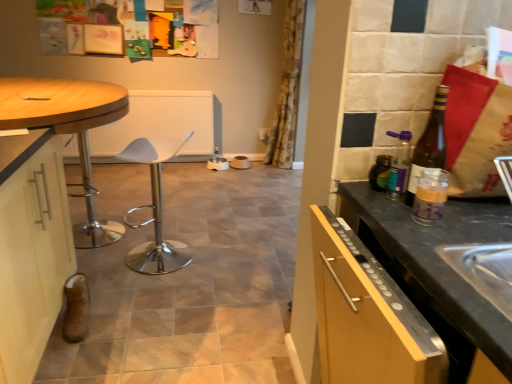
The width and height of the screenshot is (512, 384). Find the location of `vacant region to the right of white plastic bar stool at center`. vacant region to the right of white plastic bar stool at center is located at coordinates (217, 260).